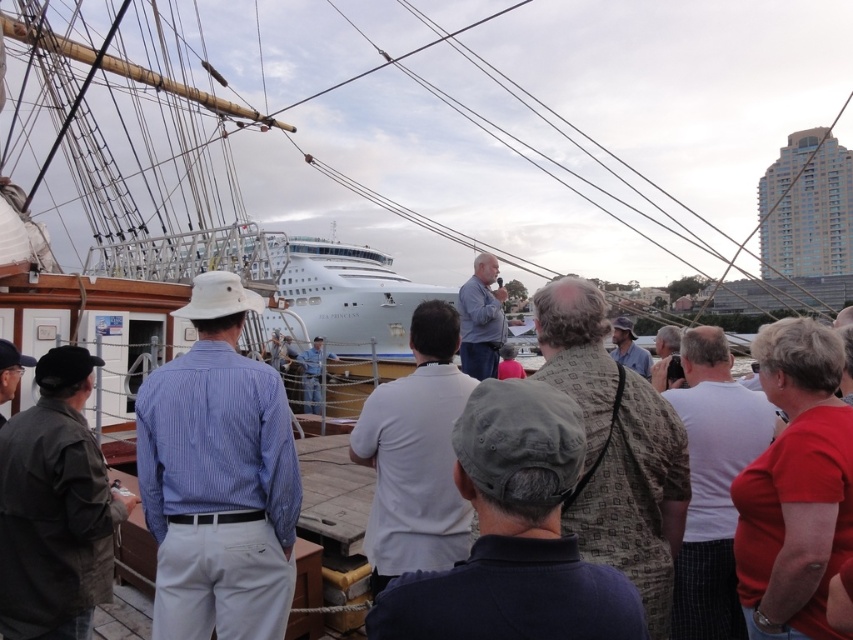
You are standing on the wooden deck and want to hand a brochure to the person wearing the dark gray fabric cap at center and the light brown leather jacket at center. Which one should you approach first if you are facing the cruise ship?

Since the dark gray fabric cap at center is to the left of the light brown leather jacket at center, you should approach the dark gray fabric cap at center first if you are facing the cruise ship.

You are a photographer standing on the wooden deck at the marina. You want to take a photo of the cruise ship SEA PRINCESS. You notice two people nearby wearing a dark gray fabric jacket at lower left and a white shirt at center. If you want to include both people in the same frame, will you need to zoom in or zoom out your camera?

The distance between the dark gray fabric jacket at lower left and the white shirt at center is 17.00 meters. To include both in the same frame, you would need to zoom out to capture the wider angle required to encompass the 17.00 meters between them.

You are a photographer at the marina and need to capture both the dark gray fabric jacket at lower left and the white shirt at center in a single frame. Which clothing item should you focus on first to ensure both are in the frame without moving the camera?

The dark gray fabric jacket at lower left is smaller in size compared to the white shirt at center. To ensure both are in the frame, focus on the smaller jacket first, then adjust the camera to include the larger shirt without moving the camera position.